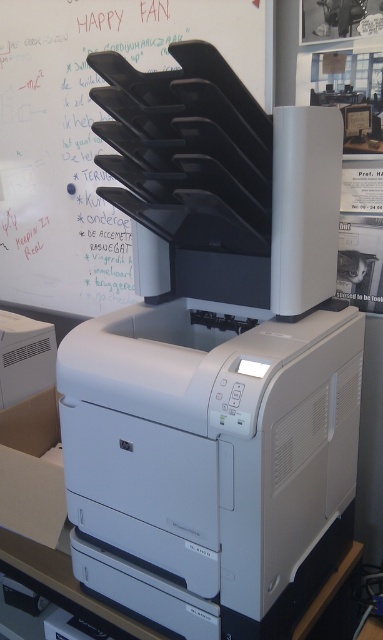
Question: Can you confirm if black plastic bulletin board at upper center is smaller than cardboard box at lower left?

Choices:
 (A) no
 (B) yes

Answer: (A)

Question: Which object is closer to the camera taking this photo?

Choices:
 (A) black plastic bulletin board at upper center
 (B) cardboard box at lower left

Answer: (B)

Question: Does black plastic bulletin board at upper center lie behind cardboard box at lower left?

Choices:
 (A) yes
 (B) no

Answer: (A)

Question: Among these objects, which one is farthest from the camera?

Choices:
 (A) cardboard box at lower left
 (B) black plastic bulletin board at upper center

Answer: (B)

Question: Which object appears farthest from the camera in this image?

Choices:
 (A) cardboard box at lower left
 (B) black plastic bulletin board at upper center

Answer: (B)

Question: Can you confirm if black plastic bulletin board at upper center is positioned to the right of cardboard box at lower left?

Choices:
 (A) yes
 (B) no

Answer: (A)